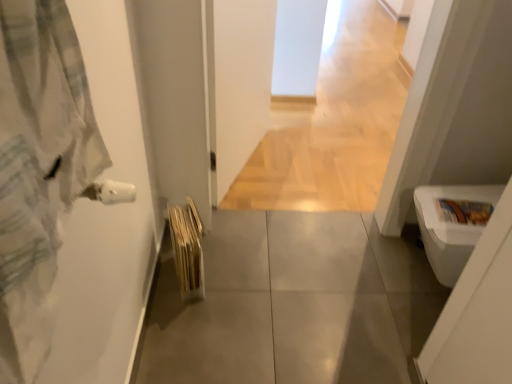
Question: Considering the positions of point (6, 362) and point (478, 195), is point (6, 362) closer or farther from the camera than point (478, 195)?

Choices:
 (A) farther
 (B) closer

Answer: (B)

Question: From a real-world perspective, is light gray flannel bathrobe at left above or below white glossy toilet bowl at lower right?

Choices:
 (A) above
 (B) below

Answer: (A)

Question: Estimate the real-world distances between objects in this image. Which object is farther from the light wood floor at center?

Choices:
 (A) light gray flannel bathrobe at left
 (B) white glossy toilet bowl at lower right
 (C) beige textured bath towel at lower left
 (D) gray tile floor at center

Answer: (A)

Question: Which of these objects is positioned closest to the beige textured bath towel at lower left?

Choices:
 (A) light wood floor at center
 (B) gray tile floor at center
 (C) light gray flannel bathrobe at left
 (D) white glossy toilet bowl at lower right

Answer: (B)